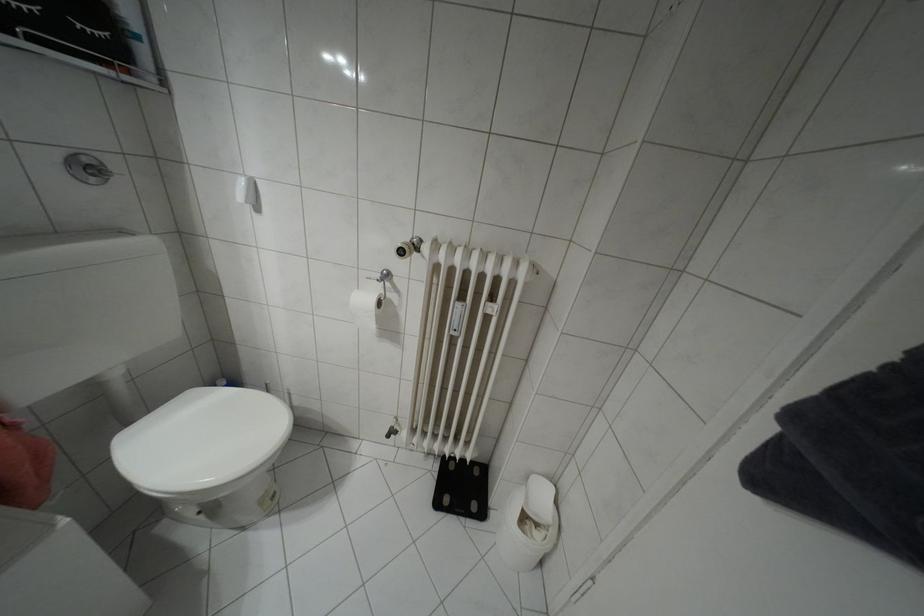
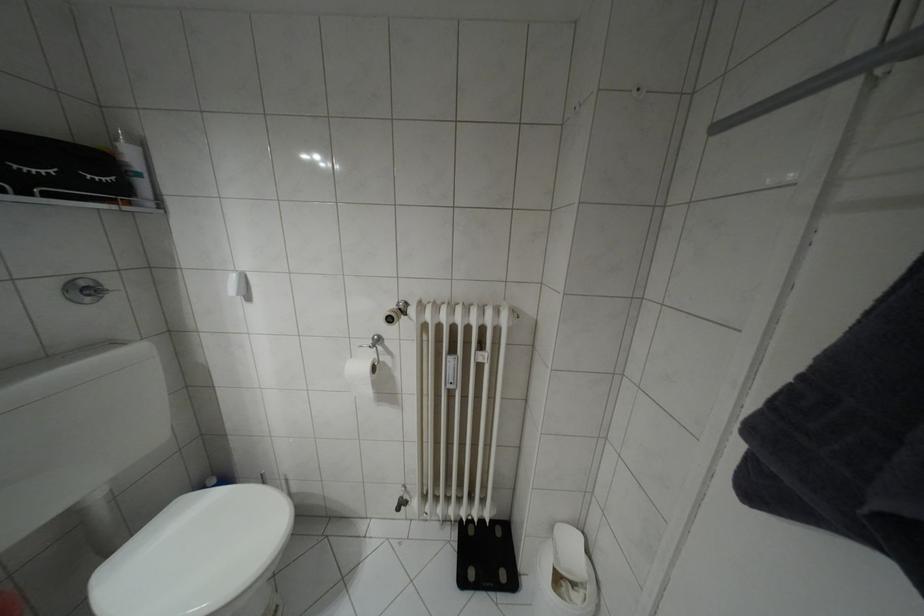
Locate, in the second image, the point that corresponds to point (554, 545) in the first image.

(598, 606)